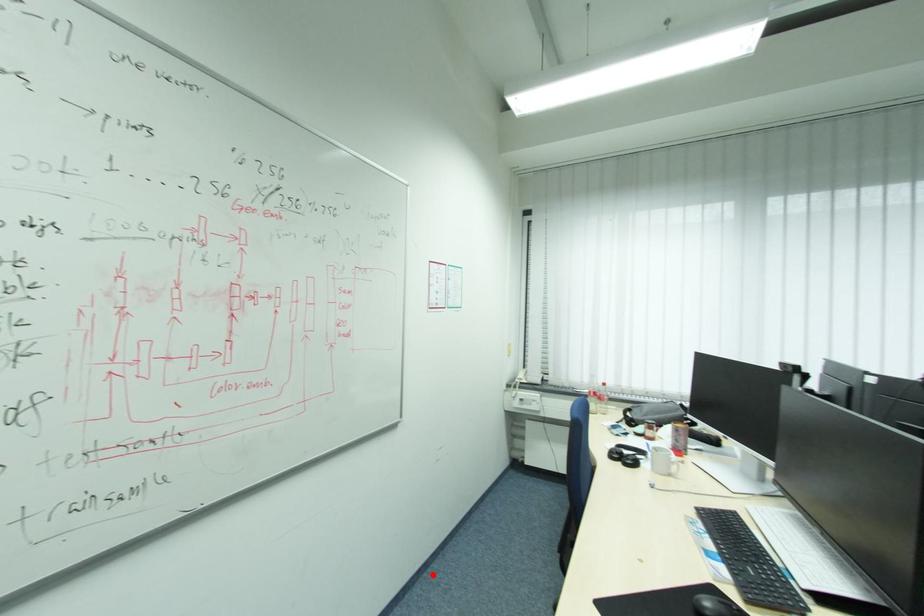
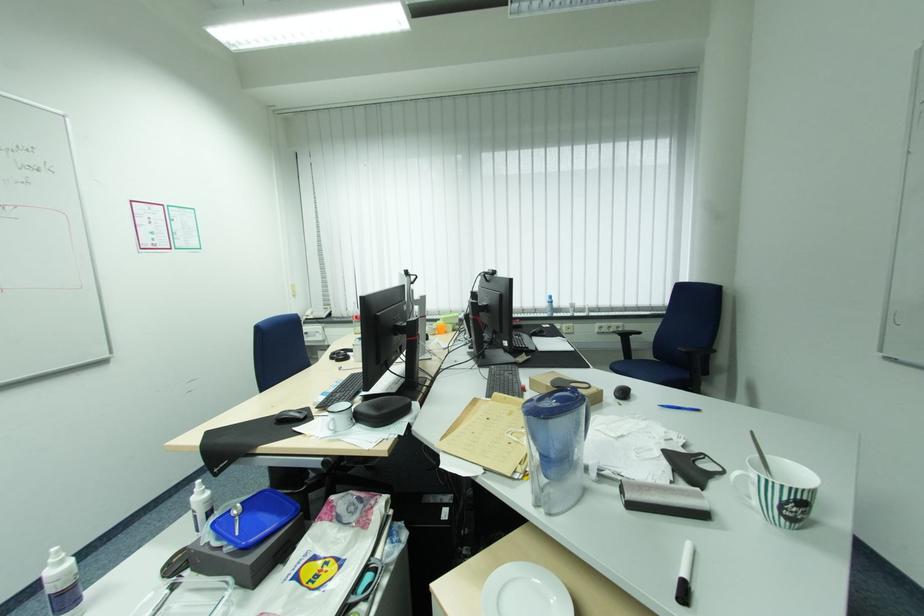
Locate, in the second image, the point that corresponds to the highlighted location in the first image.

(193, 487)